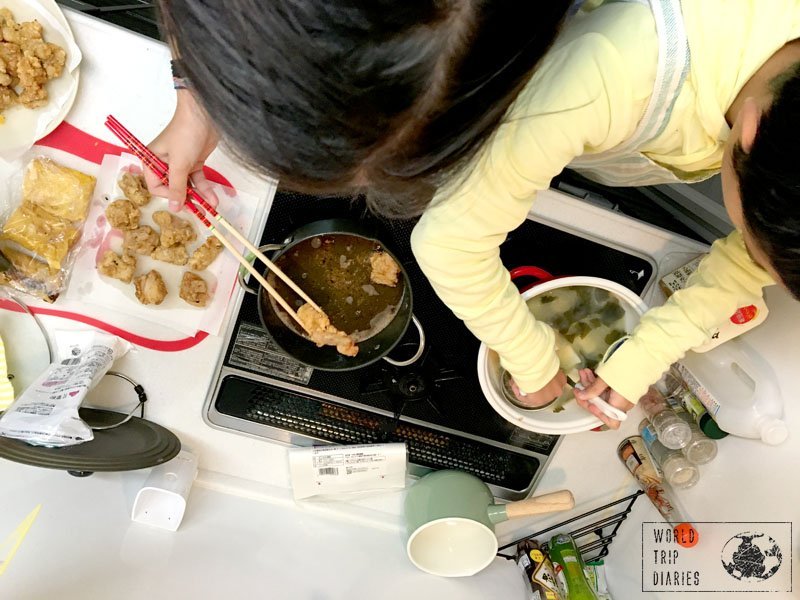
The width and height of the screenshot is (800, 600). What are the coordinates of `chopsticks` in the screenshot? It's located at click(209, 210), click(214, 233).